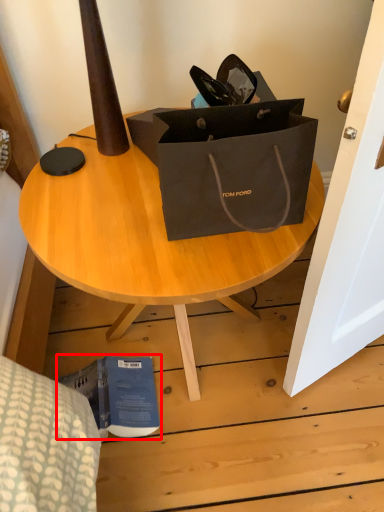
Question: In this image, where is book (annotated by the red box) located relative to coffee table?

Choices:
 (A) left
 (B) right

Answer: (A)